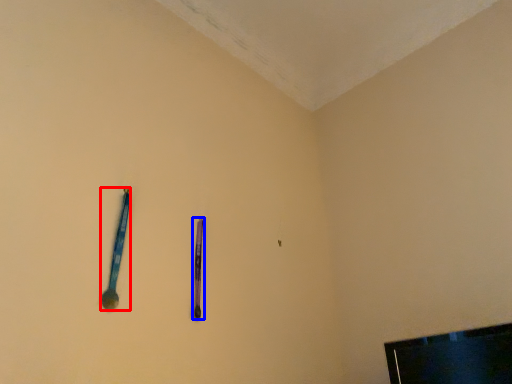
Question: Among these objects, which one is nearest to the camera, spoon (highlighted by a red box) or writing (highlighted by a blue box)?

Choices:
 (A) spoon
 (B) writing

Answer: (A)